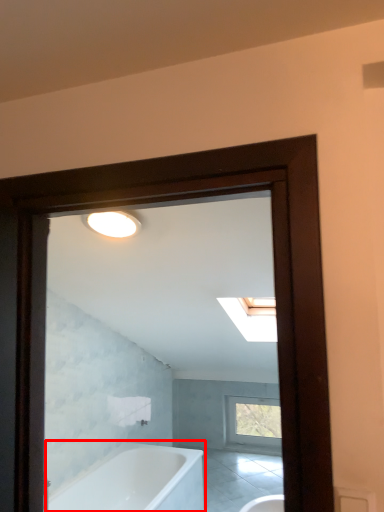
Question: Considering the relative positions of bathtub (annotated by the red box) and window in the image provided, where is bathtub (annotated by the red box) located with respect to the staircase?

Choices:
 (A) right
 (B) left

Answer: (B)